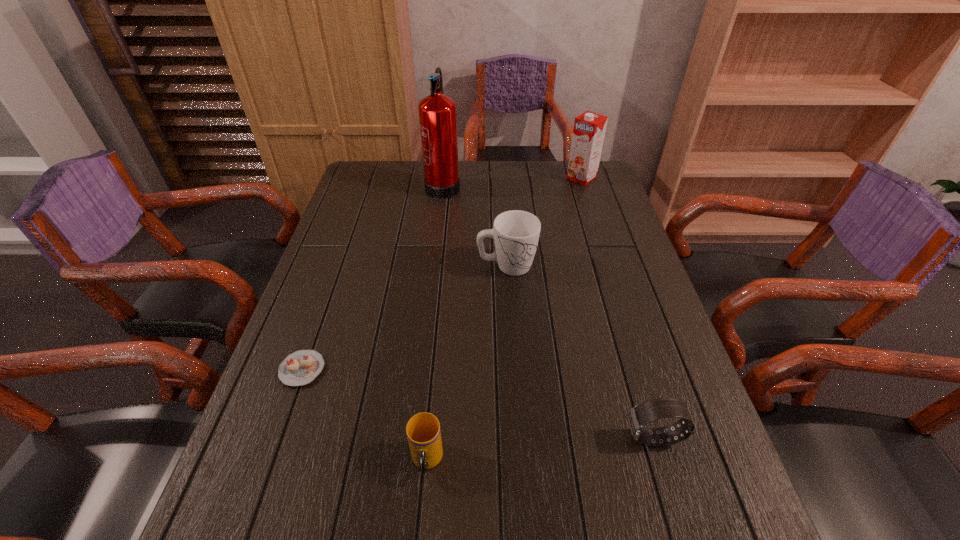
The height and width of the screenshot is (540, 960). What are the coordinates of `free space located 0.260m on the side of the third farthest object with the handle` in the screenshot? It's located at (627, 266).

Find the location of a particular element. The height and width of the screenshot is (540, 960). vacant space located on the face of the watch is located at coordinates (590, 438).

I want to click on vacant space located on the face of the watch, so click(450, 438).

The width and height of the screenshot is (960, 540). In order to click on free space located on the face of the watch in this screenshot , I will do [x=561, y=438].

The width and height of the screenshot is (960, 540). Find the location of `vacant space located 0.060m on the side of the cup with the handle`. vacant space located 0.060m on the side of the cup with the handle is located at coordinates (421, 519).

Locate an element on the screen. free spot located on the back of the cupcake is located at coordinates (327, 298).

At what (x,y) coordinates should I click in order to perform the action: click on fire extinguisher located at the far edge. Please return your answer as a coordinate pair (x, y). Looking at the image, I should click on (437, 112).

Find the location of a particular element. Image resolution: width=960 pixels, height=540 pixels. carton that is at the far edge is located at coordinates (589, 129).

The image size is (960, 540). What are the coordinates of `object that is at the left edge` in the screenshot? It's located at (301, 367).

This screenshot has height=540, width=960. Identify the location of carton situated at the right edge. click(589, 129).